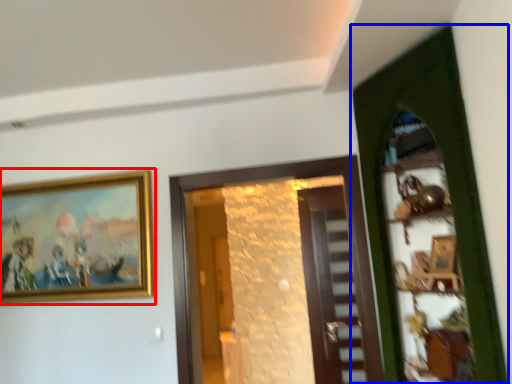
Question: Among these objects, which one is farthest to the camera, picture frame (highlighted by a red box) or door (highlighted by a blue box)?

Choices:
 (A) picture frame
 (B) door

Answer: (A)